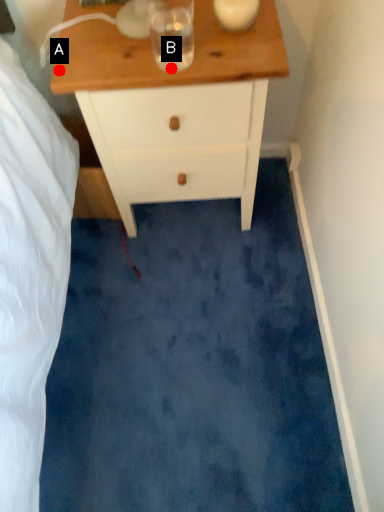
Question: Two points are circled on the image, labeled by A and B beside each circle. Which point appears closest to the camera in this image?

Choices:
 (A) A is closer
 (B) B is closer

Answer: (B)